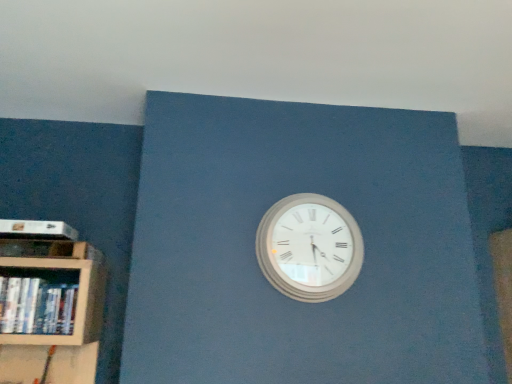
I want to click on white wooden wall clock at center, so pyautogui.click(x=309, y=247).

Where is `white wooden wall clock at center`? white wooden wall clock at center is located at coordinates (309, 247).

Would you say white glossy book at left is inside or outside white matte paperback book at left?

white glossy book at left is spatially situated outside white matte paperback book at left.

Between white glossy book at left and white matte paperback book at left, which one is positioned in front?

Positioned in front is white glossy book at left.

Is white glossy book at left thinner than white matte paperback book at left?

Indeed, white glossy book at left has a lesser width compared to white matte paperback book at left.

From a real-world perspective, is white glossy book at left above or below white matte paperback book at left?

Clearly, from a real-world perspective, white glossy book at left is below white matte paperback book at left.

I want to click on paperback book that appears on the left of white wooden wall clock at center, so click(x=37, y=230).

From a real-world perspective, is white wooden wall clock at center below white matte paperback book at left?

Indeed, from a real-world perspective, white wooden wall clock at center is positioned beneath white matte paperback book at left.

Looking at this image, is white wooden wall clock at center located outside white matte paperback book at left?

white wooden wall clock at center is positioned outside white matte paperback book at left.

Is white matte paperback book at left looking in the opposite direction of white glossy book at left?

No, white matte paperback book at left is not facing the opposite direction of white glossy book at left.

From a real-world perspective, is white matte paperback book at left on white glossy book at left?

Correct, in the physical world, white matte paperback book at left is higher than white glossy book at left.

Between white matte paperback book at left and white glossy book at left, which one has smaller width?

white glossy book at left is thinner.

From their relative heights in the image, would you say white matte paperback book at left is taller or shorter than white glossy book at left?

white matte paperback book at left is shorter than white glossy book at left.

There is a white wooden wall clock at center. At what (x,y) coordinates should I click in order to perform the action: click on paperback book above it (from a real-world perspective). Please return your answer as a coordinate pair (x, y). The height and width of the screenshot is (384, 512). Looking at the image, I should click on (37, 230).

Is white wooden wall clock at center at the back of white matte paperback book at left?

No, white matte paperback book at left's orientation is not away from white wooden wall clock at center.

Is white matte paperback book at left with white wooden wall clock at center?

white matte paperback book at left and white wooden wall clock at center are clearly separated.

At what (x,y) coordinates should I click in order to perform the action: click on wall clock positioned vertically above the white glossy book at left (from a real-world perspective). Please return your answer as a coordinate pair (x, y). This screenshot has height=384, width=512. Looking at the image, I should click on (309, 247).

Between white glossy book at left and white wooden wall clock at center, which one has smaller size?

white glossy book at left is smaller.

Measure the distance from white glossy book at left to white wooden wall clock at center.

The distance of white glossy book at left from white wooden wall clock at center is 32.77 inches.

From the image's perspective, would you say white glossy book at left is positioned over white wooden wall clock at center?

No, from the image's perspective, white glossy book at left is not over white wooden wall clock at center.

Which object is positioned more to the right, white wooden wall clock at center or white glossy book at left?

white wooden wall clock at center.

Is point (326, 197) positioned before point (20, 324)?

That is False.

Where is `book below the white wooden wall clock at center (from the image's perspective)`? The width and height of the screenshot is (512, 384). book below the white wooden wall clock at center (from the image's perspective) is located at coordinates (36, 306).

Are white wooden wall clock at center and white glossy book at left located far from each other?

No, there isn't a large distance between white wooden wall clock at center and white glossy book at left.

Image resolution: width=512 pixels, height=384 pixels. What are the coordinates of `book in front of the white matte paperback book at left` in the screenshot? It's located at (36, 306).

Locate an element on the screen. The image size is (512, 384). wall clock on the right of white matte paperback book at left is located at coordinates (309, 247).

Based on their spatial positions, is white matte paperback book at left or white wooden wall clock at center further from white glossy book at left?

Based on the image, white wooden wall clock at center appears to be further to white glossy book at left.

Estimate the real-world distances between objects in this image. Which object is further from white matte paperback book at left, white wooden wall clock at center or white glossy book at left?

Among the two, white wooden wall clock at center is located further to white matte paperback book at left.

Considering their positions, is white glossy book at left positioned further to white matte paperback book at left than white wooden wall clock at center?

Among the two, white wooden wall clock at center is located further to white matte paperback book at left.

Which object lies further to the anchor point white wooden wall clock at center, white matte paperback book at left or white glossy book at left?

white matte paperback book at left is positioned further to the anchor white wooden wall clock at center.

Considering their positions, is white glossy book at left positioned further to white wooden wall clock at center than white matte paperback book at left?

Among the two, white matte paperback book at left is located further to white wooden wall clock at center.

Looking at this image, which object lies further to the anchor point white glossy book at left, white wooden wall clock at center or white matte paperback book at left?

white wooden wall clock at center is further to white glossy book at left.

The height and width of the screenshot is (384, 512). I want to click on book between white matte paperback book at left and white wooden wall clock at center, so click(36, 306).